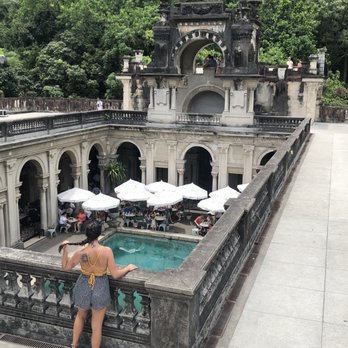
Where is `white concrete tiles`? white concrete tiles is located at coordinates (314, 214).